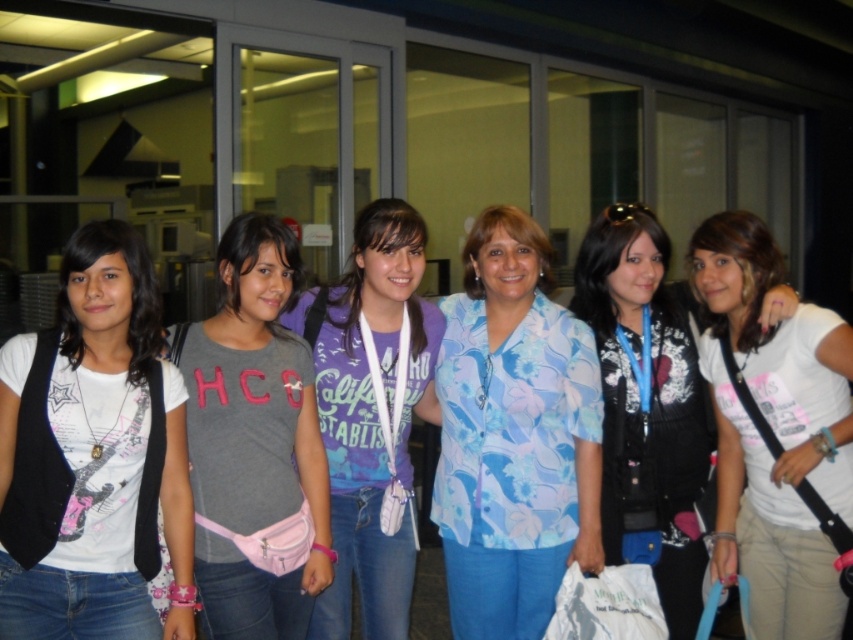
Question: Which of these objects is positioned farthest from the purple cotton shirt at center?

Choices:
 (A) black matte vest at left
 (B) floral-patterned blouse at center
 (C) gray fabric shirt at center
 (D) white cotton shirt at center

Answer: (D)

Question: Is black matte vest at left positioned in front of purple cotton shirt at center?

Choices:
 (A) yes
 (B) no

Answer: (A)

Question: Is black matte vest at left above gray fabric shirt at center?

Choices:
 (A) yes
 (B) no

Answer: (A)

Question: Based on their relative distances, which object is farther from the black matte vest at left?

Choices:
 (A) white cotton shirt at center
 (B) floral print blouse at center
 (C) purple cotton shirt at center
 (D) floral-patterned blouse at center

Answer: (A)

Question: Does gray fabric shirt at center have a larger size compared to floral print blouse at center?

Choices:
 (A) no
 (B) yes

Answer: (A)

Question: Which point is farther to the camera?

Choices:
 (A) black matte vest at left
 (B) purple cotton shirt at center

Answer: (B)